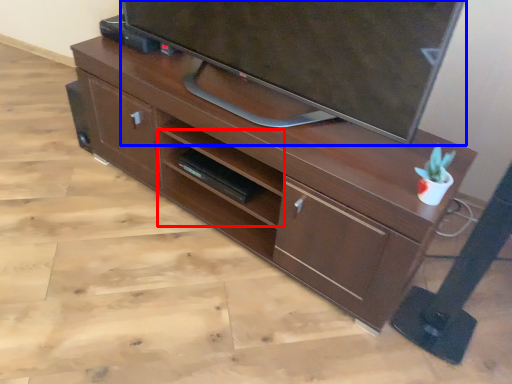
Question: Which of the following is the closest to the observer, shelf (highlighted by a red box) or television (highlighted by a blue box)?

Choices:
 (A) shelf
 (B) television

Answer: (B)